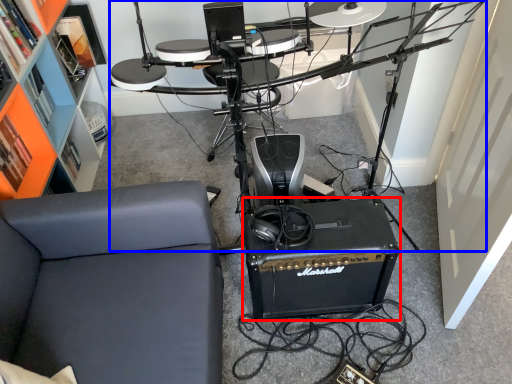
Question: Which of the following is the closest to the observer, speaker (highlighted by a red box) or computer desk (highlighted by a blue box)?

Choices:
 (A) speaker
 (B) computer desk

Answer: (B)